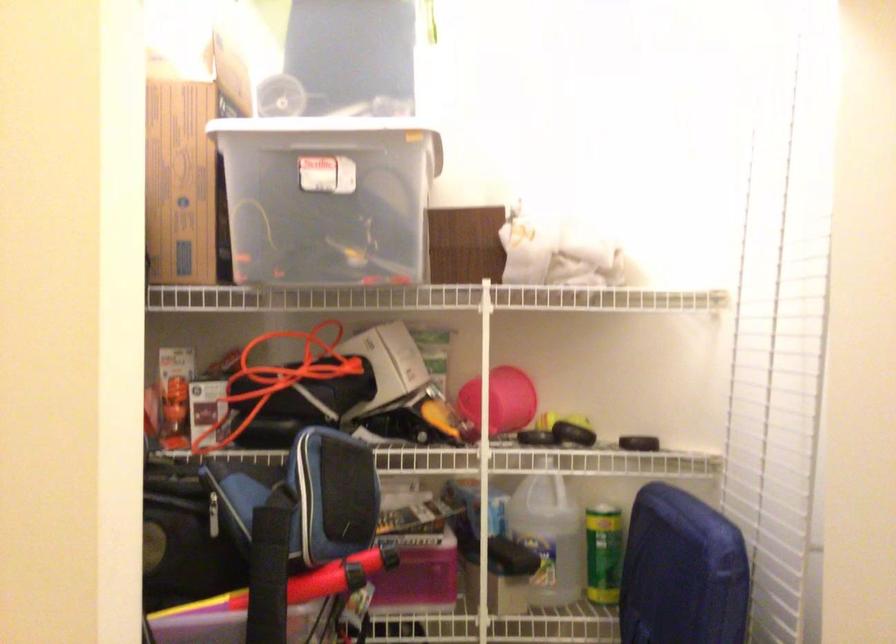
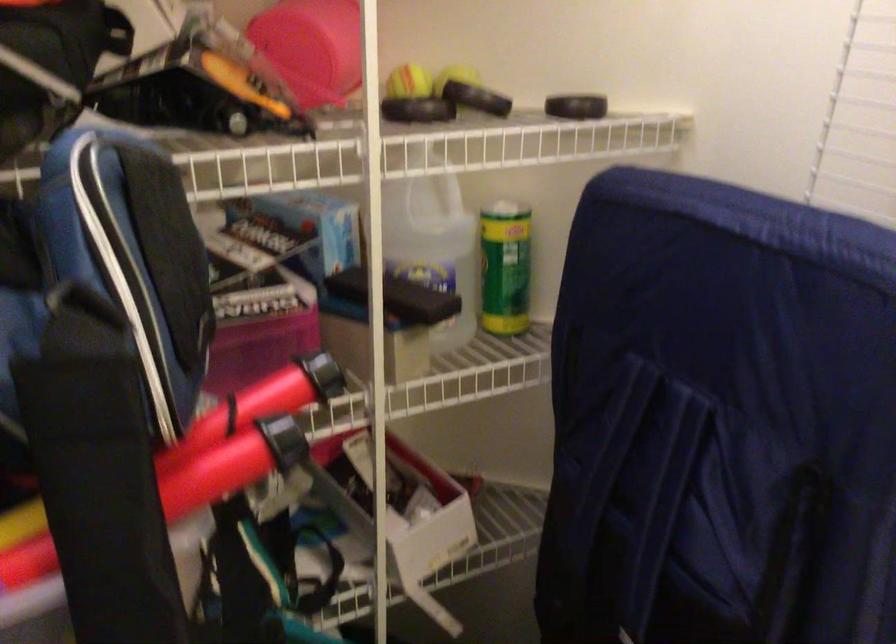
Locate, in the second image, the point that corresponds to [570,422] in the first image.

(457, 76)